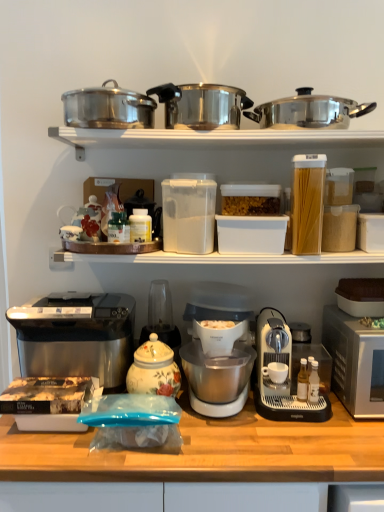
At what (x,y) coordinates should I click in order to perform the action: click on free space in front of metallic silver coffee maker at lower right, which is the 2th coffee maker from left to right. Please return your answer as a coordinate pair (x, y). The width and height of the screenshot is (384, 512). Looking at the image, I should click on (304, 439).